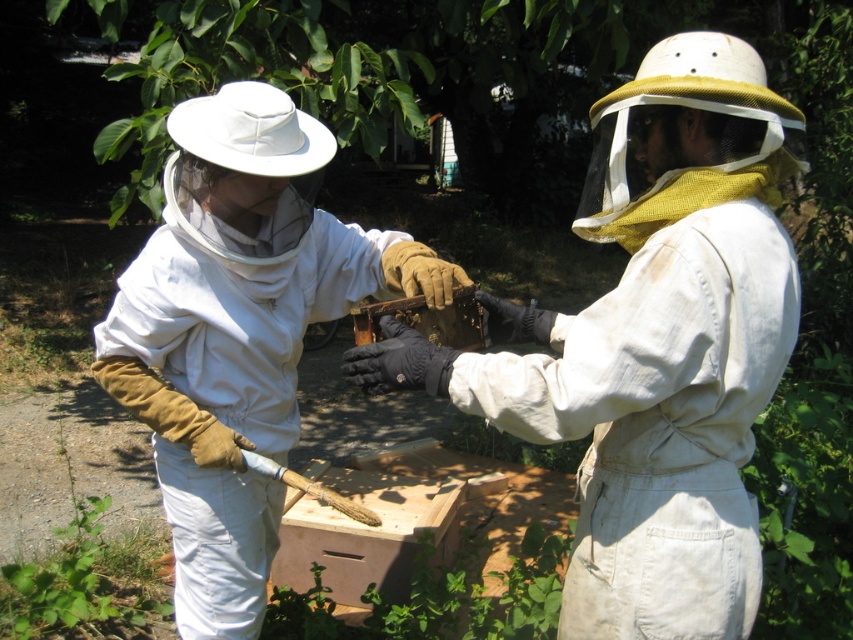
Between white cotton beekeeper suit at center and wooden honeycomb at center, which one appears on the left side from the viewer's perspective?

wooden honeycomb at center is more to the left.

Who is shorter, white cotton beekeeper suit at center or wooden honeycomb at center?

With less height is wooden honeycomb at center.

At what (x,y) coordinates should I click in order to perform the action: click on white cotton beekeeper suit at center. Please return your answer as a coordinate pair (x, y). This screenshot has width=853, height=640. Looking at the image, I should click on (653, 348).

At what (x,y) coordinates should I click in order to perform the action: click on white cotton beekeeper suit at center. Please return your answer as a coordinate pair (x, y). The width and height of the screenshot is (853, 640). Looking at the image, I should click on (653, 348).

Who is lower down, white cotton beekeeper suit at center or white matte beekeeper suit at center?

white matte beekeeper suit at center

Locate an element on the screen. white cotton beekeeper suit at center is located at coordinates (653, 348).

Is white matte beekeeper suit at center positioned behind wooden honeycomb at center?

Yes, it is.

Who is more distant from viewer, (196,524) or (463,304)?

Positioned behind is point (196,524).

Who is more forward, (288, 436) or (396, 314)?

Point (396, 314) is in front.

You are a GUI agent. You are given a task and a screenshot of the screen. Output one action in this format:
    pyautogui.click(x=<x>, y=<y>)
    Task: Click on the white matte beekeeper suit at center
    
    Given the screenshot: What is the action you would take?
    (238, 332)